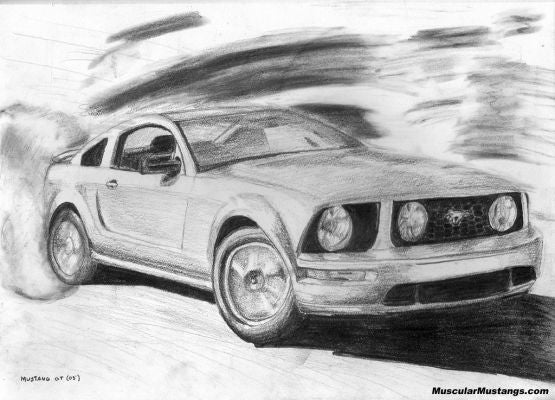
Locate an element on the screen. Image resolution: width=555 pixels, height=400 pixels. the headrest is located at coordinates (166, 144).